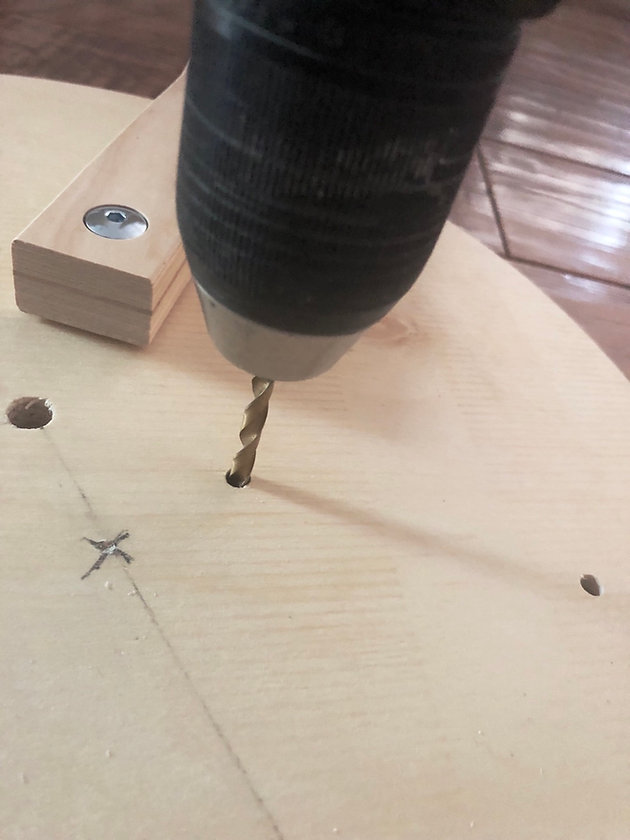
Image resolution: width=630 pixels, height=840 pixels. In order to click on floor on the right side in this screenshot , I will do `click(569, 211)`.